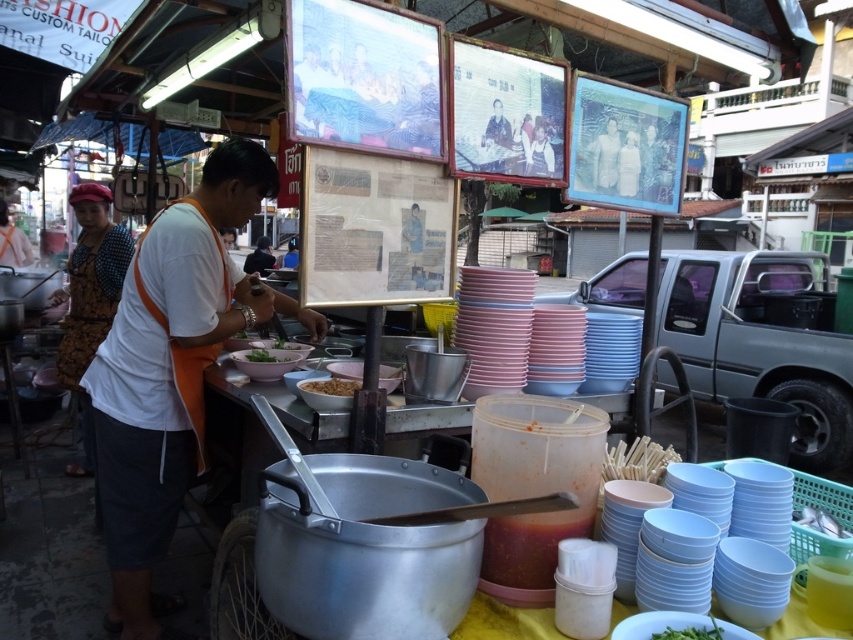
You are a customer standing at the food stall and want to grab the green matte vegetable at lower center. Considering your average arm length is 2.5 feet, can you reach it without moving closer?

The green matte vegetable at lower center is 4.56 feet away from the camera, which is further than your arm length of 2.5 feet. Therefore, you cannot reach it without moving closer.

You are a customer at the food stall and want to place your order. You notice two points marked on the stall layout. The first point is at coordinates point (706, 634) and the second is at point (276, 348). Which point is closer to you as you stand in front of the stall?

Point (706, 634) is in front of point (276, 348), so it is closer to you.

You are a customer at the food stall and want to point out the brown matte food at center to the vendor. Which direction should you look relative to the patterned fabric headscarf at left?

The patterned fabric headscarf at left is above the brown matte food at center, so you should look downward from the patterned fabric headscarf at left to locate the brown matte food at center.